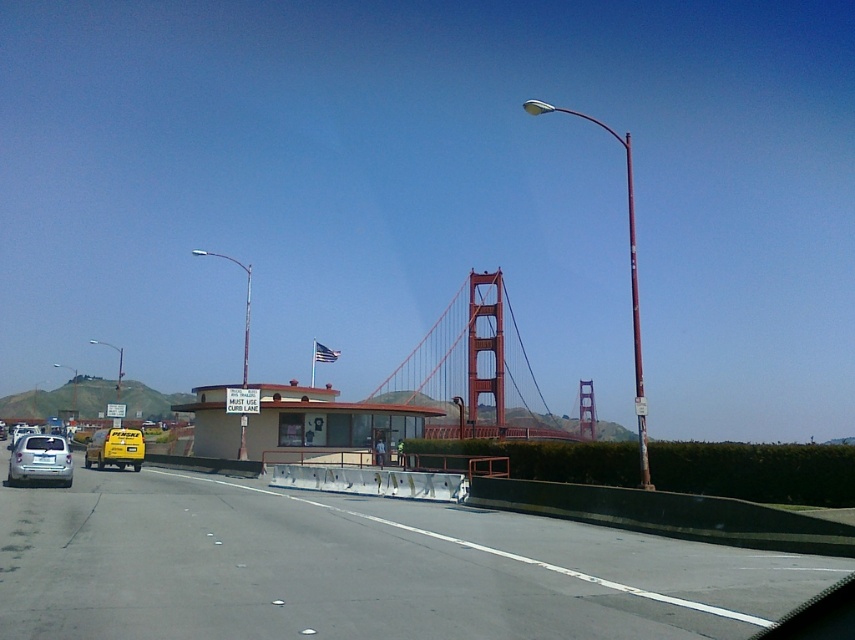
You are standing at the point labeled point (486, 628) and want to walk to the Golden Gate Bridge. Which direction should you go to reach the bridge?

The point labeled point (486, 628) is located near the foreground of the image, so you should walk towards the center of the image where the Golden Gate Bridge is prominently displayed.

You are a tourist standing at the Golden Gate Bridge and want to take a photo of the gray asphalt highway at center. Where should you position yourself to capture the highway at point [358,568]?

You should position yourself directly in front of the gray asphalt highway at center, as it is located at point [358,568].